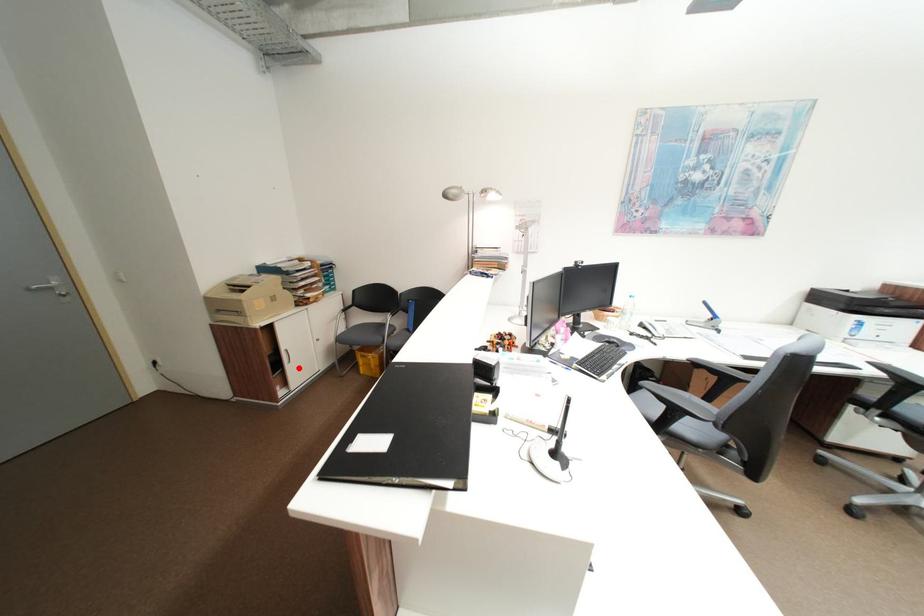
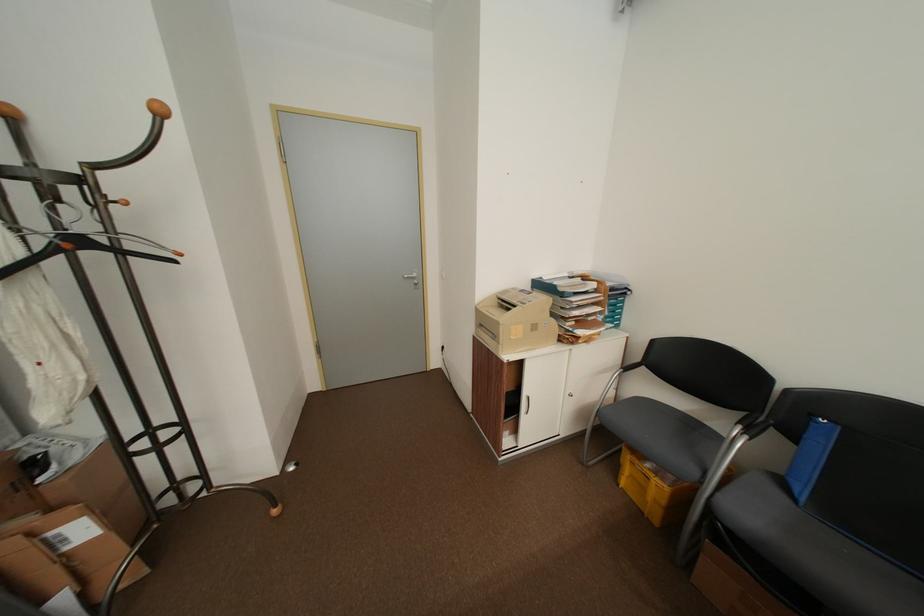
Question: I am providing you with two images of the same scene from different viewpoints. Image1 has a red point marked. In image2, the corresponding 3D location appears at what relative position? Reply with the corresponding letter.

Choices:
 (A) Closer
 (B) Farther

Answer: (B)